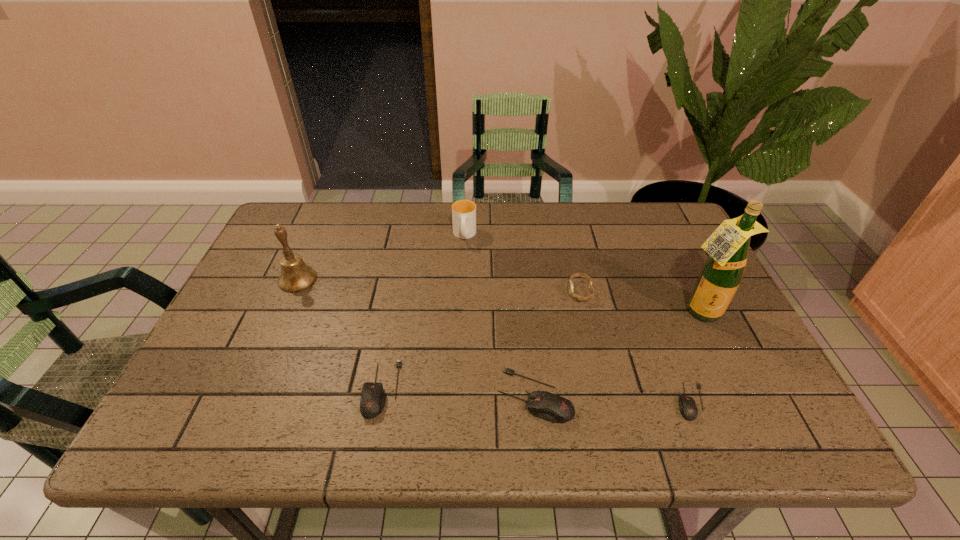
Image resolution: width=960 pixels, height=540 pixels. I want to click on the leftmost object, so click(296, 276).

Where is `watch`? The height and width of the screenshot is (540, 960). watch is located at coordinates (570, 286).

Image resolution: width=960 pixels, height=540 pixels. In order to click on blank space located on the back of the sixth object from right to left in this screenshot , I will do `click(398, 295)`.

Find the location of `vacant area situated on the right of the fourth object from left to right`. vacant area situated on the right of the fourth object from left to right is located at coordinates (674, 395).

Identify the location of vacant area located on the back of the second object from right to left. The image size is (960, 540). (664, 334).

Identify the location of vacant space located 0.140m with the handle on the side of the cup. The image size is (960, 540). (463, 279).

What are the coordinates of `vacant region located on the front-facing side of the liquor` in the screenshot? It's located at (723, 360).

This screenshot has height=540, width=960. Identify the location of free spot located on the front of the sixth shortest object. (279, 321).

Find the location of `vacant region located 0.380m on the face of the fifth object from left to right`. vacant region located 0.380m on the face of the fifth object from left to right is located at coordinates (425, 292).

I want to click on vacant space positioned 0.240m on the face of the fifth object from left to right, so click(x=478, y=292).